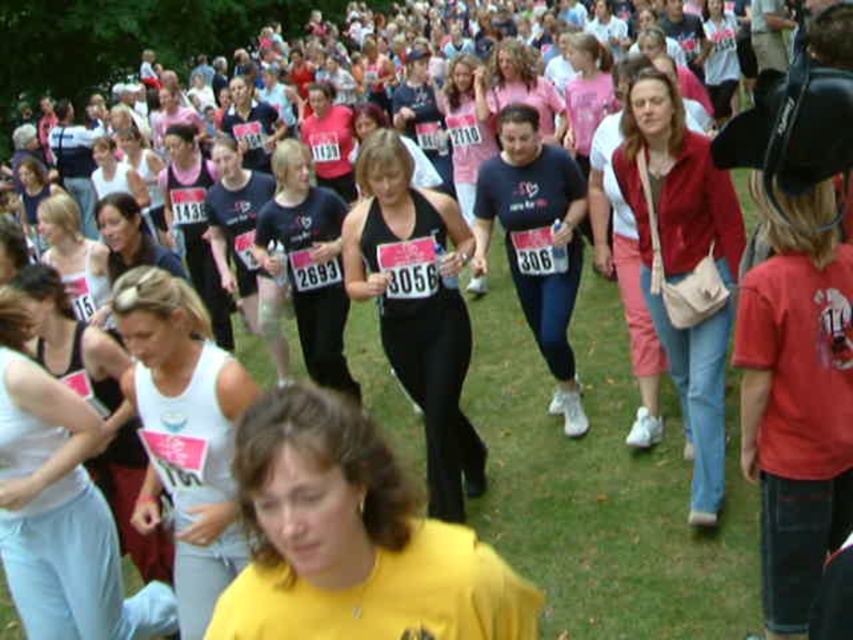
Which of these two, yellow matte shirt at center or velvet red jacket at center, stands taller?

With more height is velvet red jacket at center.

This screenshot has width=853, height=640. Describe the element at coordinates (352, 540) in the screenshot. I see `yellow matte shirt at center` at that location.

The width and height of the screenshot is (853, 640). In order to click on yellow matte shirt at center in this screenshot , I will do `click(352, 540)`.

The width and height of the screenshot is (853, 640). In order to click on yellow matte shirt at center in this screenshot , I will do `click(352, 540)`.

Between matte black tank top at center and velvet red jacket at center, which one appears on the left side from the viewer's perspective?

matte black tank top at center is more to the left.

Is matte black tank top at center positioned behind velvet red jacket at center?

Yes, matte black tank top at center is further from the viewer.

Between point (437, 380) and point (735, 262), which one is positioned in front?

Positioned in front is point (735, 262).

Where is `matte black tank top at center`? The height and width of the screenshot is (640, 853). matte black tank top at center is located at coordinates (416, 307).

Who is positioned more to the left, white matte tank top at center or matte black tank top at center?

white matte tank top at center is more to the left.

Is white matte tank top at center further to the viewer compared to matte black tank top at center?

No, it is not.

Is point (164, 374) closer to camera compared to point (345, 273)?

Yes, point (164, 374) is in front of point (345, 273).

Identify the location of white matte tank top at center. (184, 432).